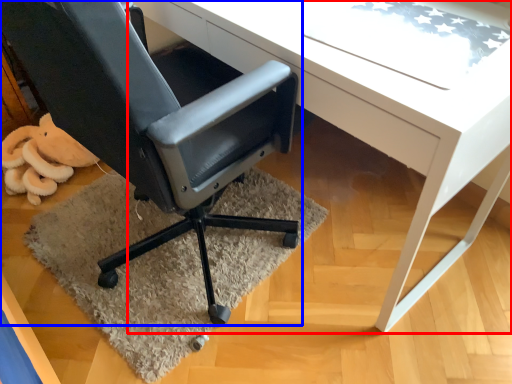
Question: Which object is closer to the camera taking this photo, desk (highlighted by a red box) or chair (highlighted by a blue box)?

Choices:
 (A) desk
 (B) chair

Answer: (B)